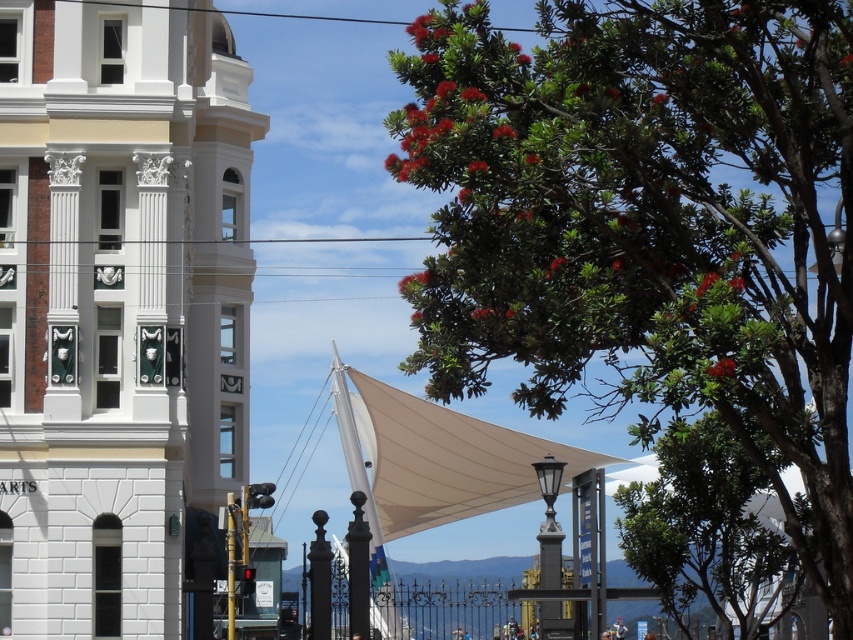
Who is positioned more to the right, green leafy tree at upper right or white stone bell tower at left?

green leafy tree at upper right

Between point (656, 308) and point (71, 563), which one is positioned behind?

Positioned behind is point (71, 563).

Locate an element on the screen. Image resolution: width=853 pixels, height=640 pixels. green leafy tree at upper right is located at coordinates (648, 225).

Between point (16, 445) and point (624, 497), which one is positioned behind?

The point (624, 497) is more distant.

Can you confirm if white stone bell tower at left is bigger than green leafy tree at center?

Actually, white stone bell tower at left might be smaller than green leafy tree at center.

Who is more forward, [225,340] or [663,532]?

Point [663,532] is in front.

Locate an element on the screen. white stone bell tower at left is located at coordinates [x=117, y=305].

Can you confirm if green leafy tree at upper right is positioned to the left of green leafy tree at center?

In fact, green leafy tree at upper right is to the right of green leafy tree at center.

Is green leafy tree at upper right bigger than green leafy tree at center?

Yes.

Is point (811, 536) farther from camera compared to point (637, 516)?

No, it is in front of (637, 516).

Image resolution: width=853 pixels, height=640 pixels. In order to click on green leafy tree at upper right in this screenshot , I will do pos(648,225).